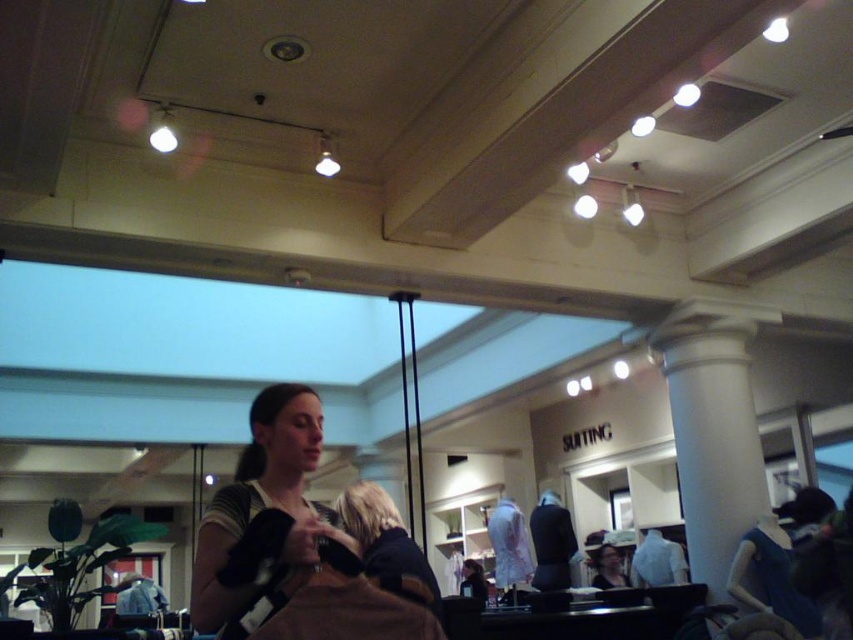
You are standing in the retail store and see two points marked in the image. Which point is closer to you, point (718, 433) or point (302, 451)?

Point (718, 433) is further to the viewer than point (302, 451), so point (302, 451) is closer to you.

You are a customer in the store and want to pick up the matte brown purse at center. Can you reach it without moving closer?

The matte brown purse at center is 1.58 meters away from viewer, so you can reach it without moving closer if your arm length is at least 1.58 meters. However, most people have shorter arms, so you might need to step closer.